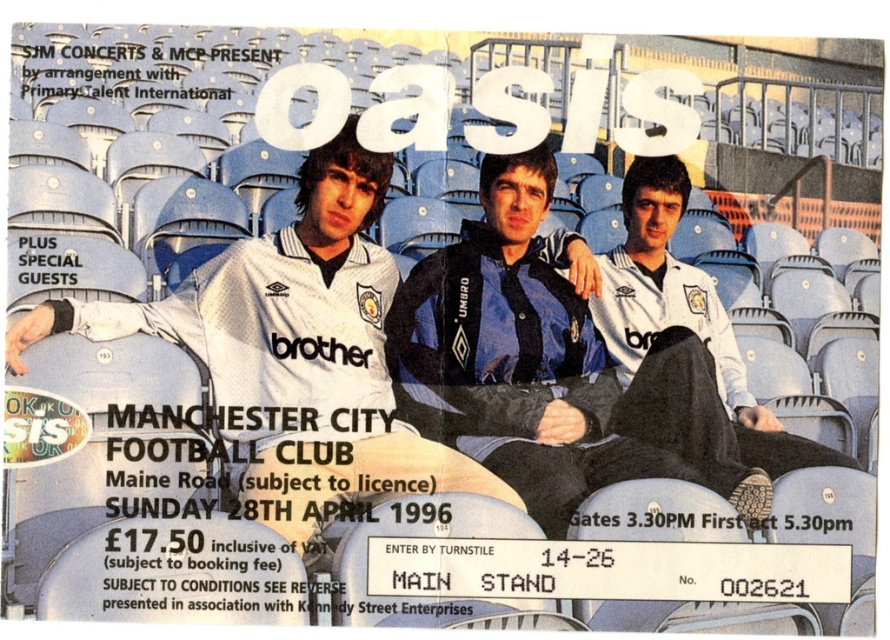
You are designing a poster for the concert and want to ensure the band members are clearly visible. Which jersey, the blue jersey at center or the white jersey at center, should you enlarge more to make sure both are equally noticeable?

The blue jersey at center is smaller than the white jersey at center, so you should enlarge the blue jersey at center more to make them equally noticeable.

Looking at this image, you are designing a poster for the concert and need to place both the blue jersey at center and the white jersey at center side by side. Given their sizes, which jersey should you place on the left to ensure they fit within a 1.2 meter wide space?

The blue jersey at center is narrower than the white jersey at center. To fit both within the 1.2 meter space, place the narrower blue jersey at center on the left and the wider white jersey at center on the right.